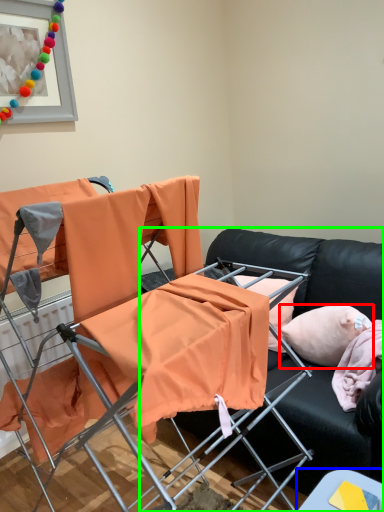
Question: Based on their relative distances, which object is farther from pillow (highlighted by a red box)? Choose from table (highlighted by a blue box) and studio couch (highlighted by a green box).

Choices:
 (A) table
 (B) studio couch

Answer: (A)